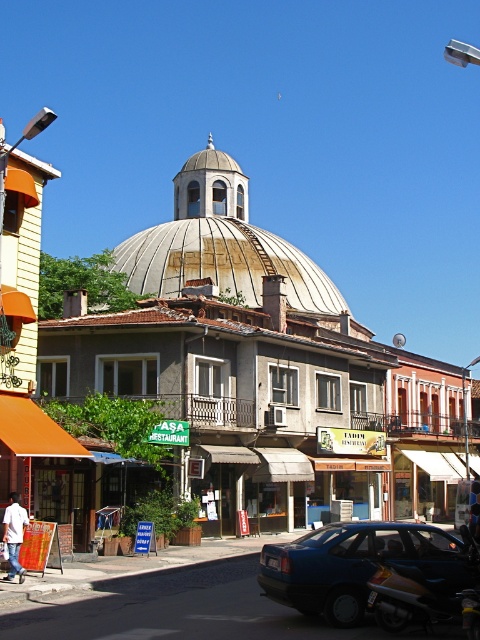
Question: Can you confirm if blue matte sedan at lower right is wider than shiny chrome motorcycle at lower right?

Choices:
 (A) yes
 (B) no

Answer: (A)

Question: Which is farther from the white textured dome at center?

Choices:
 (A) blue matte sedan at lower right
 (B) shiny chrome motorcycle at lower right
 (C) rusty metal dome at center

Answer: (B)

Question: Among these points, which one is nearest to the camera?

Choices:
 (A) (418, 580)
 (B) (299, 573)

Answer: (A)

Question: Is white textured dome at center below blue matte sedan at lower right?

Choices:
 (A) no
 (B) yes

Answer: (A)

Question: Does white textured dome at center have a lesser width compared to blue matte sedan at lower right?

Choices:
 (A) no
 (B) yes

Answer: (A)

Question: Which of the following is the closest to the observer?

Choices:
 (A) rusty metal dome at center
 (B) shiny chrome motorcycle at lower right
 (C) white textured dome at center

Answer: (B)